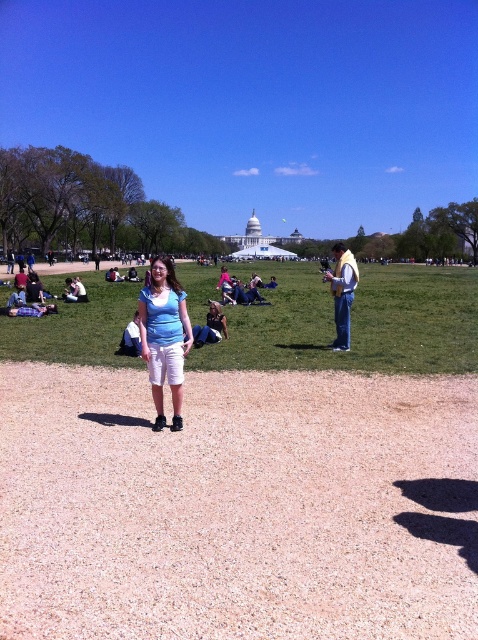
You are a photographer planning to take a photo of the green grass at center and the yellow fabric scarf at right. Based on their positions, which object is wider in the image?

The green grass at center might be wider than yellow fabric scarf at right according to the description.

You are a photographer setting up for an outdoor event. You see the green grass at center and the yellow fabric scarf at right in your viewfinder. Based on their positions, which object is closer to the camera?

The yellow fabric scarf at right is closer to the camera because the green grass at center is located above it, indicating it is in a more distant plane.